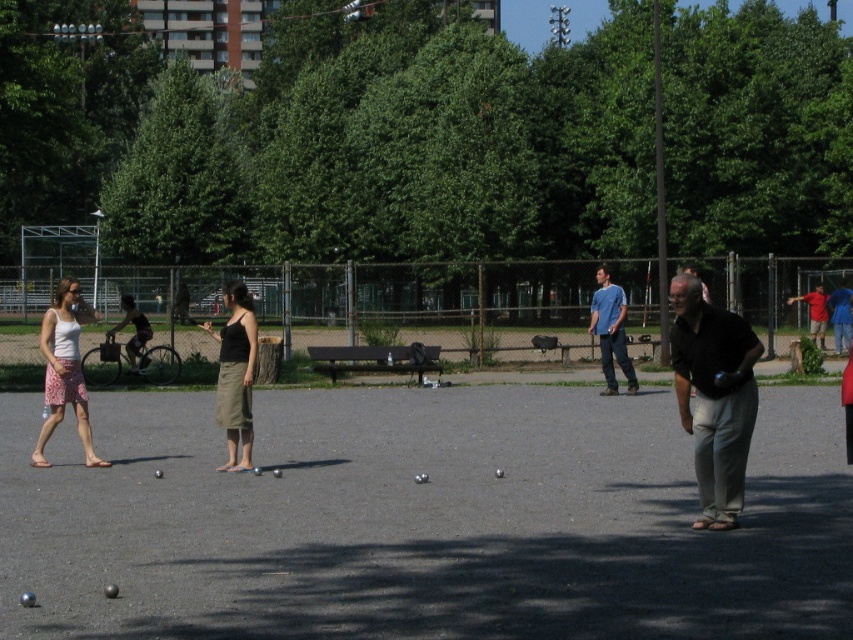
You are a photographer wanting to capture a photo of the light pink floral skirt at left and the matte blue shirt at center. Which of the two should you focus on first if you want to ensure both are in the frame without moving the camera?

The light pink floral skirt at left is shorter than the matte blue shirt at center, so you should focus on the matte blue shirt at center first to ensure both are in frame.